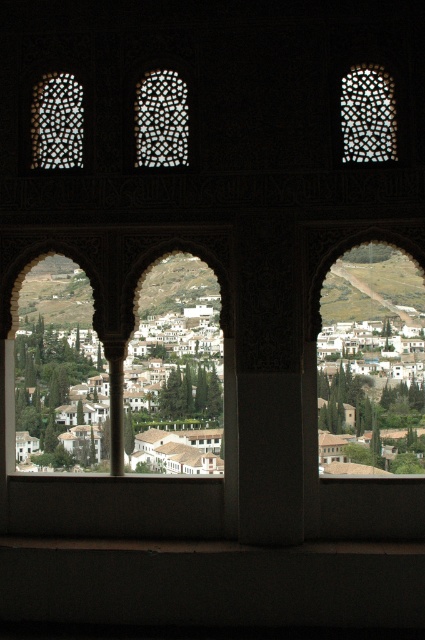
You are standing in a historical building and looking through three arches. You notice a white mosaic tile at point (368, 115). Based on the coordinates given, is the white mosaic tile located to the left or right of the central arch?

The white mosaic tile at point (368, 115) is located at the upper right, so it is to the right of the central arch.

What can be seen at the coordinates point [61,396] in the image?

At point [61,396] lies white textured buildings at center.

You are an interior designer assessing the placement of decorative tiles in a historical building. You have two tiles to place on a wall section that requires symmetry. The white mosaic tile at upper right and the translucent mosaic tile at center are available. Based on their current positions, which tile should be moved to achieve a symmetrical layout?

The white mosaic tile at upper right should be moved to the left side of the translucent mosaic tile at center to create symmetry, as it is currently positioned on the right side of the translucent mosaic tile at center.